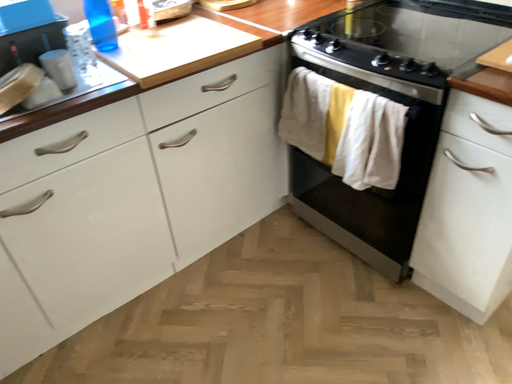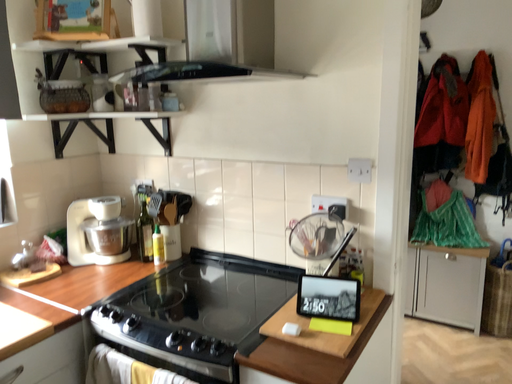
Question: How did the camera likely rotate when shooting the video?

Choices:
 (A) rotated upward
 (B) rotated downward

Answer: (A)